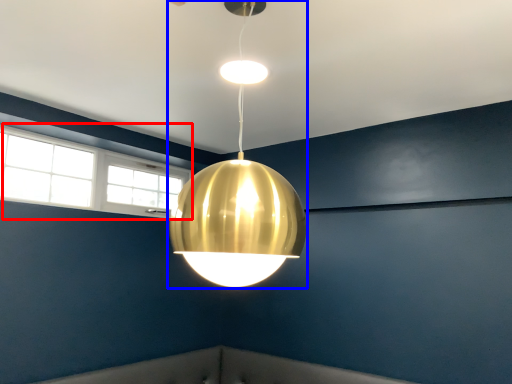
Question: Which of the following is the closest to the observer, window (highlighted by a red box) or lamp (highlighted by a blue box)?

Choices:
 (A) window
 (B) lamp

Answer: (B)